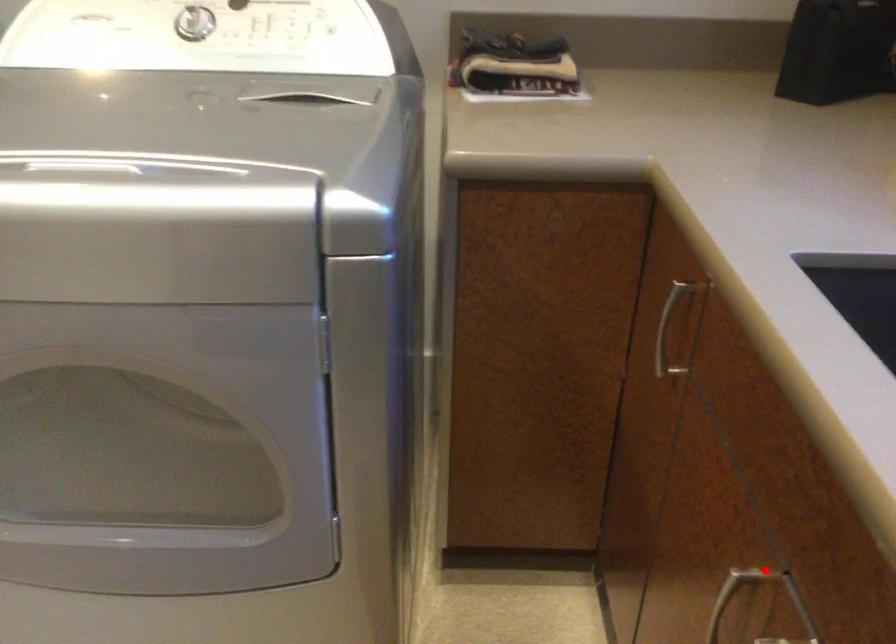
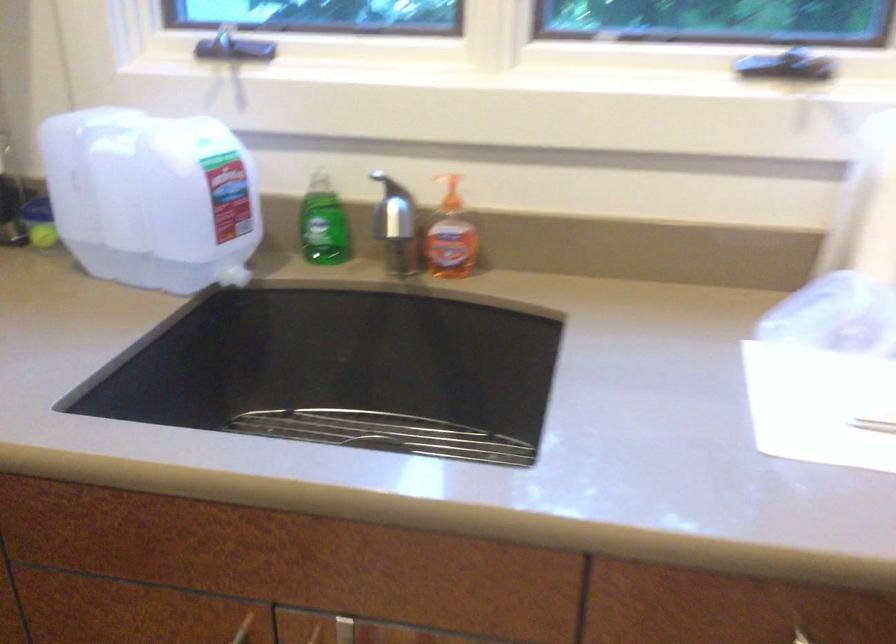
Find the pixel in the second image that matches the highlighted location in the first image.

(243, 629)